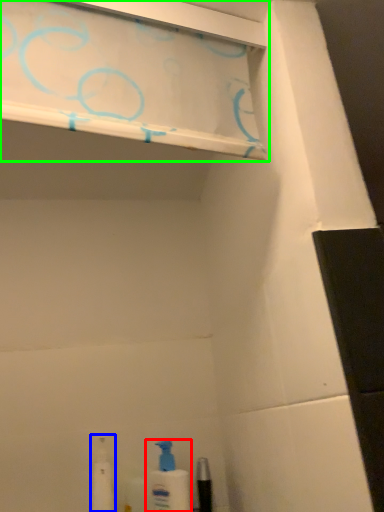
Question: Considering the real-world distances, which object is closest to cleaning product (highlighted by a red box)? toiletry (highlighted by a blue box) or shelf (highlighted by a green box).

Choices:
 (A) toiletry
 (B) shelf

Answer: (A)